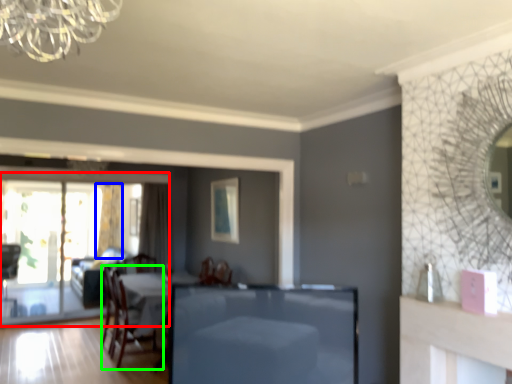
Question: Which is farther away from screen door (highlighted by a red box)? curtain (highlighted by a blue box) or chair (highlighted by a green box)?

Choices:
 (A) curtain
 (B) chair

Answer: (B)